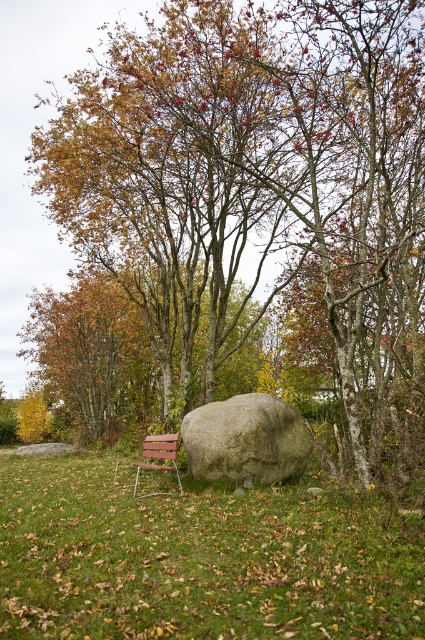
You are planning to place a small garden ornament between the brown textured rock at center and the gray rough boulder at center. Based on their positions, which object should the ornament be closer to in order to be placed exactly halfway between them?

The ornament should be placed closer to the brown textured rock at center since it is in front of the gray rough boulder at center, so the halfway point would be nearer to the rock.

You are sitting on the wooden park bench at lower left and want to place your backpack on the brown textured rock at center. Which direction should you look to place it correctly?

The brown textured rock at center is to the right of the wooden park bench at lower left, so you should look to your right to place your backpack correctly.